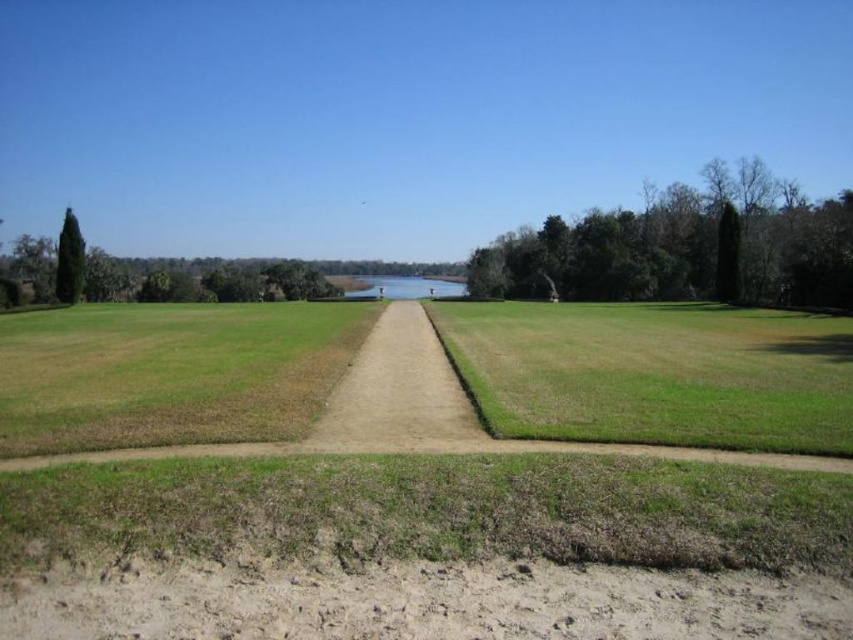
Question: Estimate the real-world distances between objects in this image. Which object is closer to the green grass at right?

Choices:
 (A) dirt/gravel path at center
 (B) green grass at center
 (C) green leafy tree at right

Answer: (A)

Question: From the image, what is the correct spatial relationship of dirt/gravel path at center in relation to green matte tree at upper left?

Choices:
 (A) left
 (B) right

Answer: (B)

Question: Is green leafy tree at right smaller than dirt/gravel path at center?

Choices:
 (A) no
 (B) yes

Answer: (A)

Question: Which is nearer to the green grass at center?

Choices:
 (A) green grass at right
 (B) dirt/gravel path at center

Answer: (B)

Question: Which is farther from the blue glass lake at center?

Choices:
 (A) green leafy tree at right
 (B) green grass at right
 (C) green matte tree at upper left
 (D) dirt/gravel path at center

Answer: (D)

Question: Can you confirm if green grass at right is thinner than dirt/gravel path at center?

Choices:
 (A) no
 (B) yes

Answer: (A)